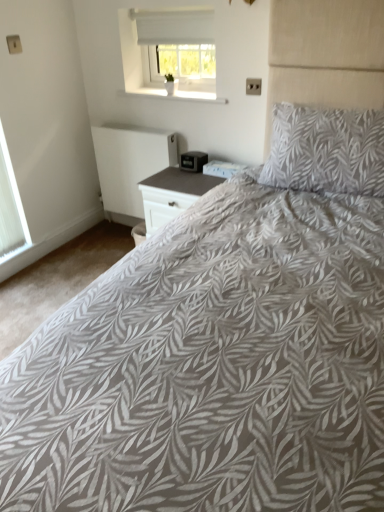
Question: Which direction should I rotate to look at white matte window at upper center, which is the first window from top to bottom?

Choices:
 (A) right
 (B) left

Answer: (B)

Question: Is gray leaf-patterned pillow at upper right with white matte radiator at lower left?

Choices:
 (A) yes
 (B) no

Answer: (B)

Question: Does gray leaf-patterned pillow at upper right lie in front of white matte radiator at lower left?

Choices:
 (A) yes
 (B) no

Answer: (A)

Question: Does gray leaf-patterned pillow at upper right have a larger size compared to white matte radiator at lower left?

Choices:
 (A) no
 (B) yes

Answer: (B)

Question: Is gray leaf-patterned pillow at upper right taller than white matte radiator at lower left?

Choices:
 (A) no
 (B) yes

Answer: (A)

Question: From the image's perspective, is gray leaf-patterned pillow at upper right below white matte radiator at lower left?

Choices:
 (A) no
 (B) yes

Answer: (A)

Question: Can you confirm if gray leaf-patterned pillow at upper right is smaller than white matte radiator at lower left?

Choices:
 (A) yes
 (B) no

Answer: (B)

Question: Considering the relative positions of gray leaf-patterned pillow at upper right and white matte window at upper center, the second window viewed from the left, in the image provided, is gray leaf-patterned pillow at upper right to the left of white matte window at upper center, the second window viewed from the left, from the viewer's perspective?

Choices:
 (A) no
 (B) yes

Answer: (A)

Question: Considering the relative sizes of gray leaf-patterned pillow at upper right and white matte window at upper center, which is the first window from top to bottom, in the image provided, is gray leaf-patterned pillow at upper right taller than white matte window at upper center, which is the first window from top to bottom,?

Choices:
 (A) yes
 (B) no

Answer: (A)

Question: From a real-world perspective, does gray leaf-patterned pillow at upper right stand above white matte window at upper center, the second window viewed from the left?

Choices:
 (A) no
 (B) yes

Answer: (A)

Question: From a real-world perspective, is gray leaf-patterned pillow at upper right physically below white matte window at upper center, which is the first window from top to bottom?

Choices:
 (A) no
 (B) yes

Answer: (B)

Question: Is white matte window at upper center, the second window viewed from the left, completely or partially inside gray leaf-patterned pillow at upper right?

Choices:
 (A) no
 (B) yes

Answer: (A)

Question: Does gray leaf-patterned pillow at upper right lie behind white matte window at upper center, arranged as the 1th window when viewed from the right?

Choices:
 (A) yes
 (B) no

Answer: (B)

Question: Is white matte radiator at lower left in contact with white textured window at left, positioned as the second window in right-to-left order?

Choices:
 (A) yes
 (B) no

Answer: (B)